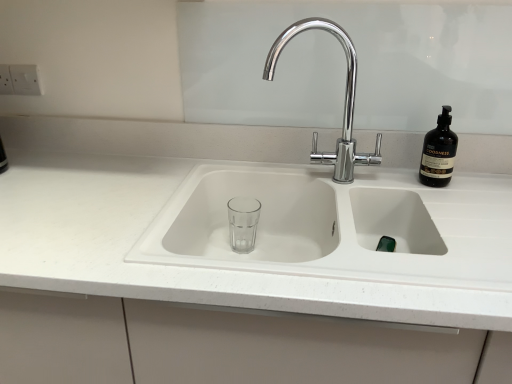
This screenshot has height=384, width=512. In order to click on free space to the left of dark brown glass bottle at upper right in this screenshot , I will do `click(379, 178)`.